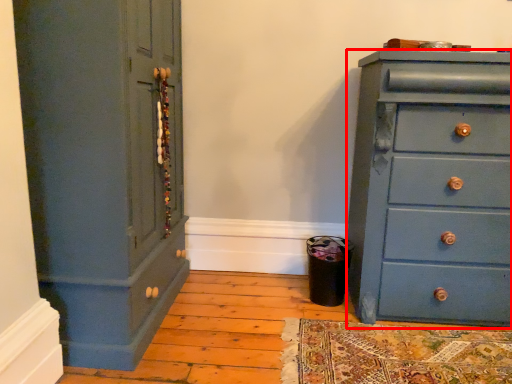
Question: Where is chest of drawers (annotated by the red box) located in relation to cupboard in the image?

Choices:
 (A) left
 (B) right

Answer: (B)